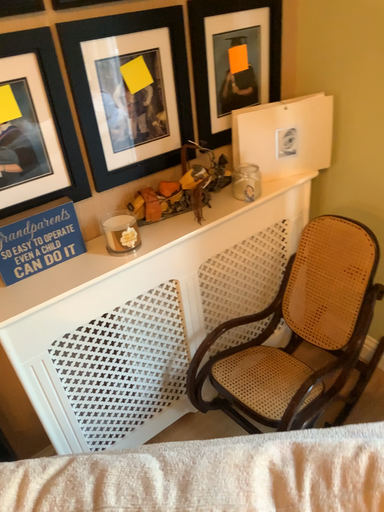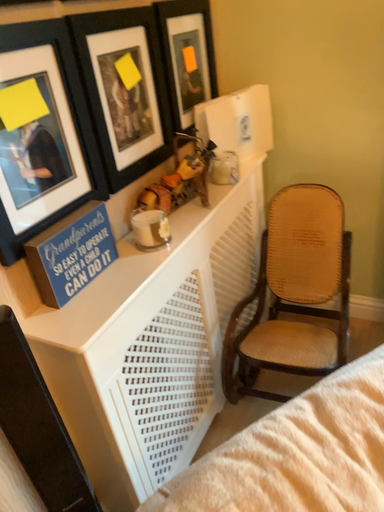
Question: How did the camera likely rotate when shooting the video?

Choices:
 (A) rotated downward
 (B) rotated upward

Answer: (B)